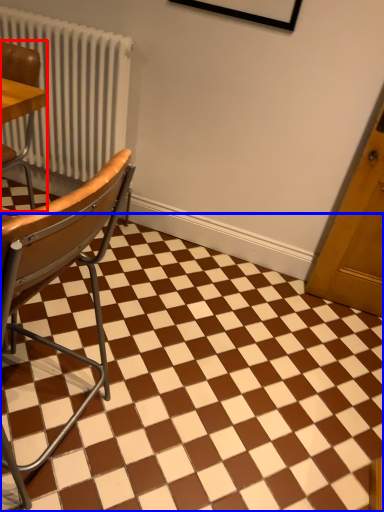
Question: Which object appears closest to the camera in this image, chair (highlighted by a red box) or square (highlighted by a blue box)?

Choices:
 (A) chair
 (B) square

Answer: (B)